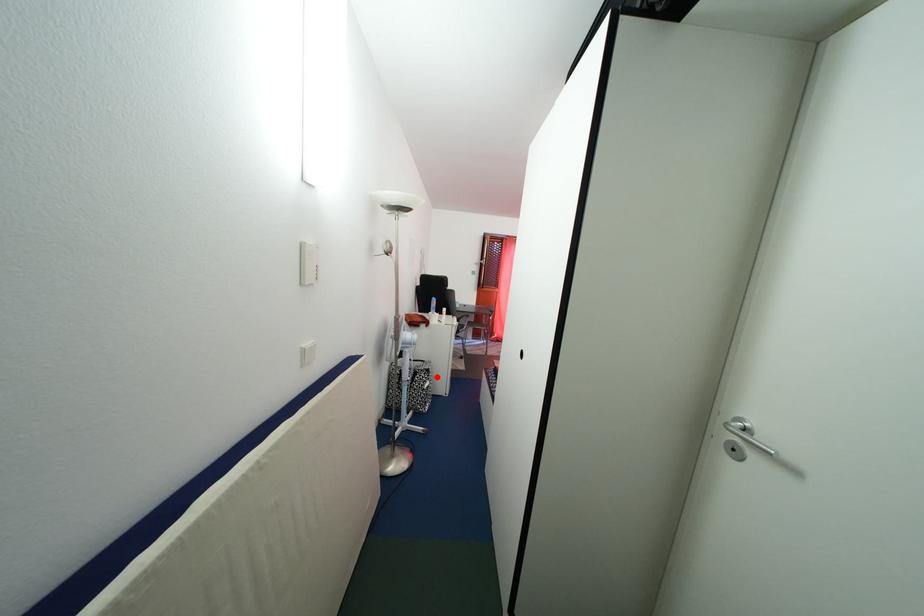
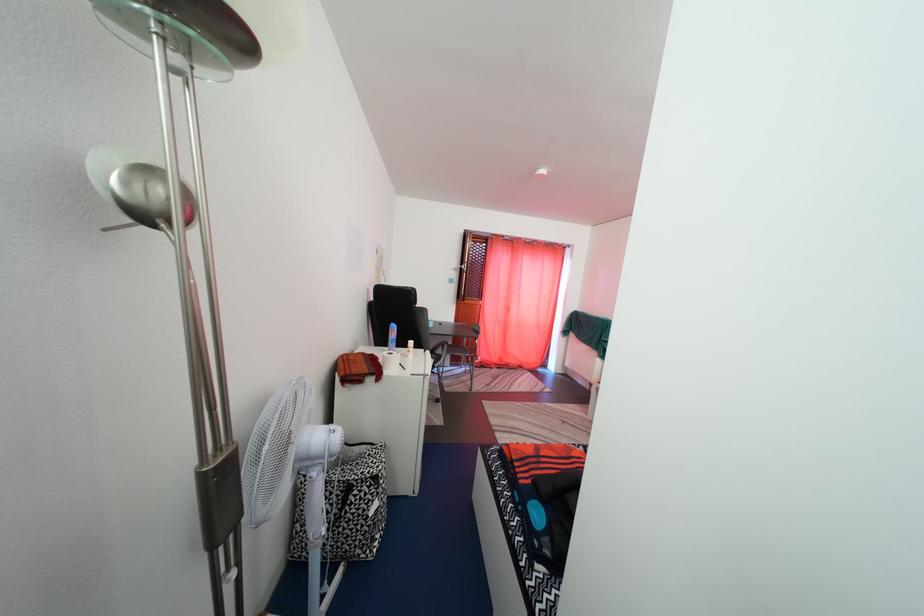
Question: A red point is marked in image1. In image2, is the corresponding 3D point closer to the camera or farther? Reply with the corresponding letter.

Choices:
 (A) The corresponding 3D point is closer.
 (B) The corresponding 3D point is farther.

Answer: (B)